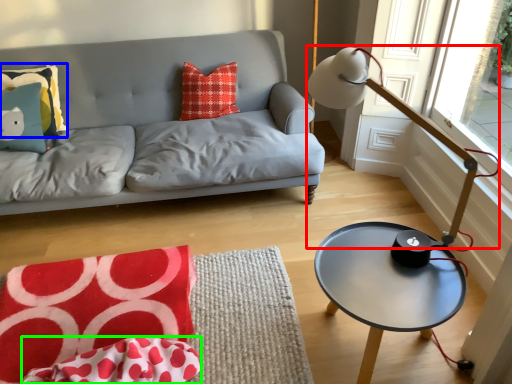
Question: Estimate the real-world distances between objects in this image. Which object is farther from table lamp (highlighted by a red box), pillow (highlighted by a blue box) or material (highlighted by a green box)?

Choices:
 (A) pillow
 (B) material

Answer: (A)